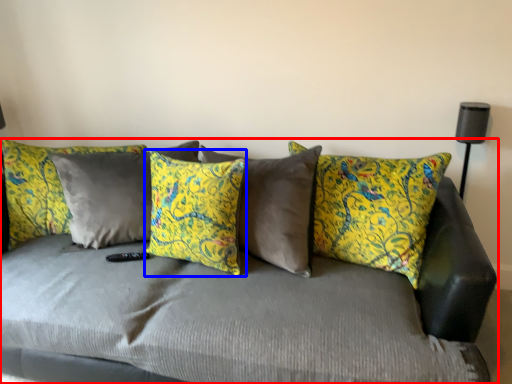
Question: Which point is closer to the camera, studio couch (highlighted by a red box) or pillow (highlighted by a blue box)?

Choices:
 (A) studio couch
 (B) pillow

Answer: (A)